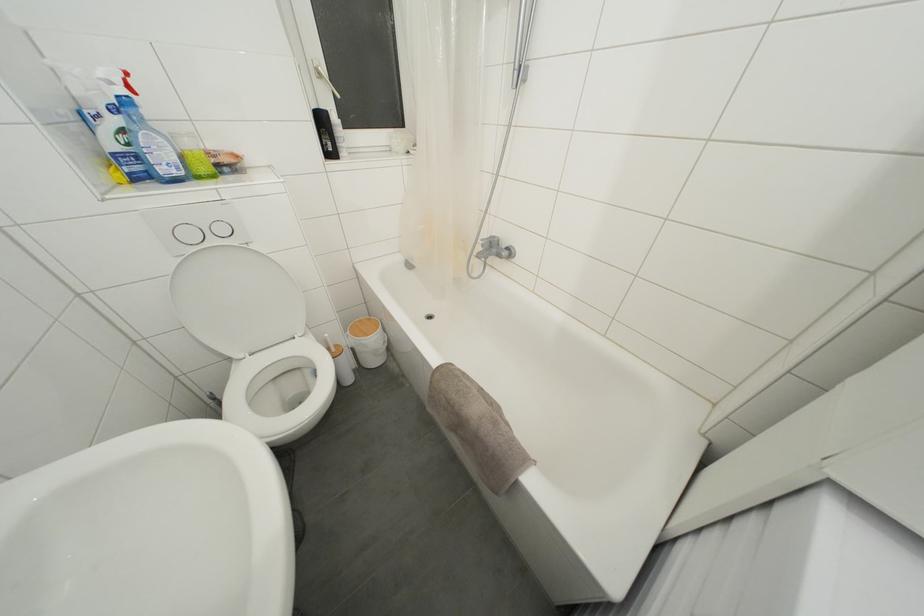
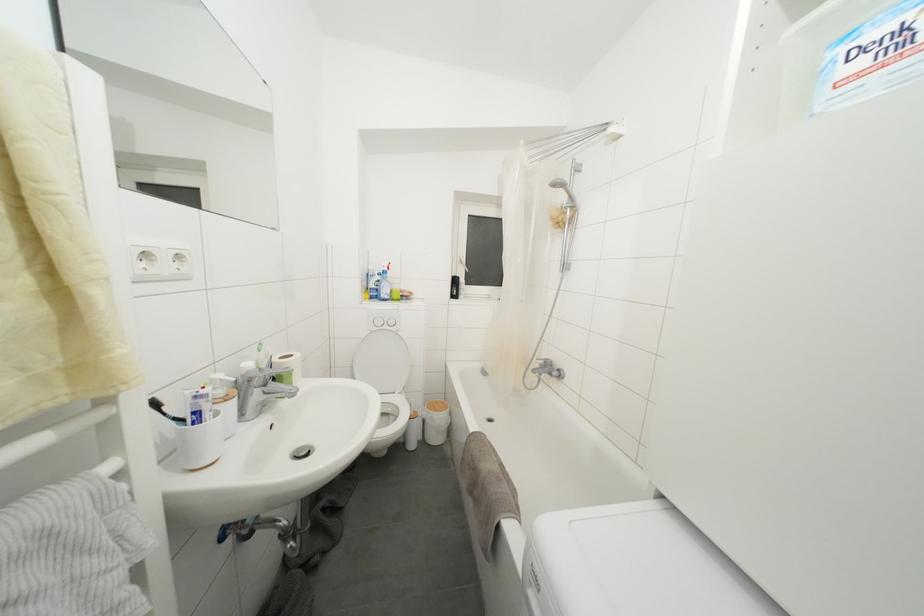
Where in the second image is the point corresponding to point 141,175 from the first image?

(379, 300)